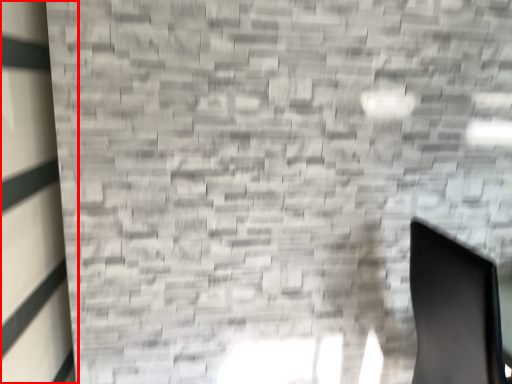
Question: Considering the relative positions of window (annotated by the red box) and swivel chair in the image provided, where is window (annotated by the red box) located with respect to the staircase?

Choices:
 (A) right
 (B) left

Answer: (B)